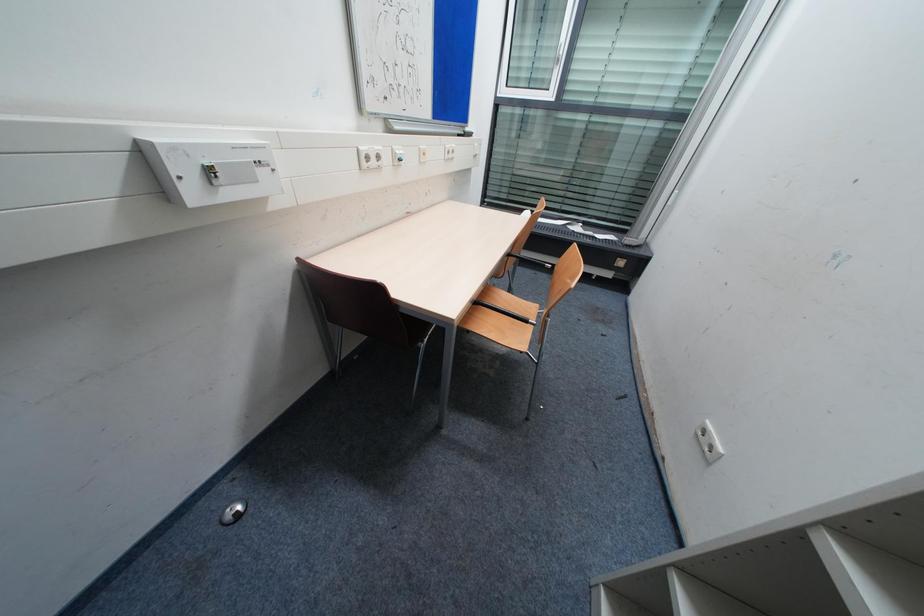
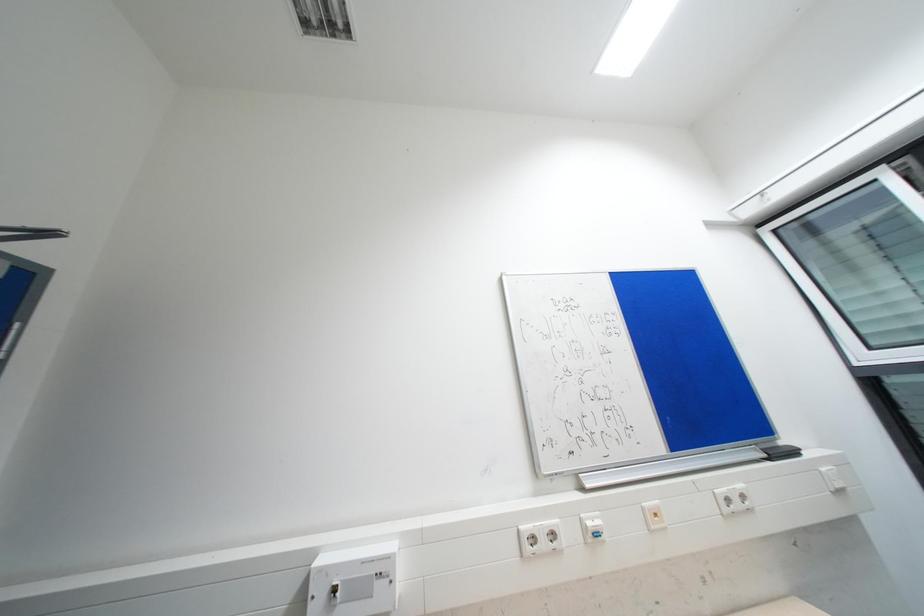
How did the camera likely rotate?

The camera's rotation is toward left-up.